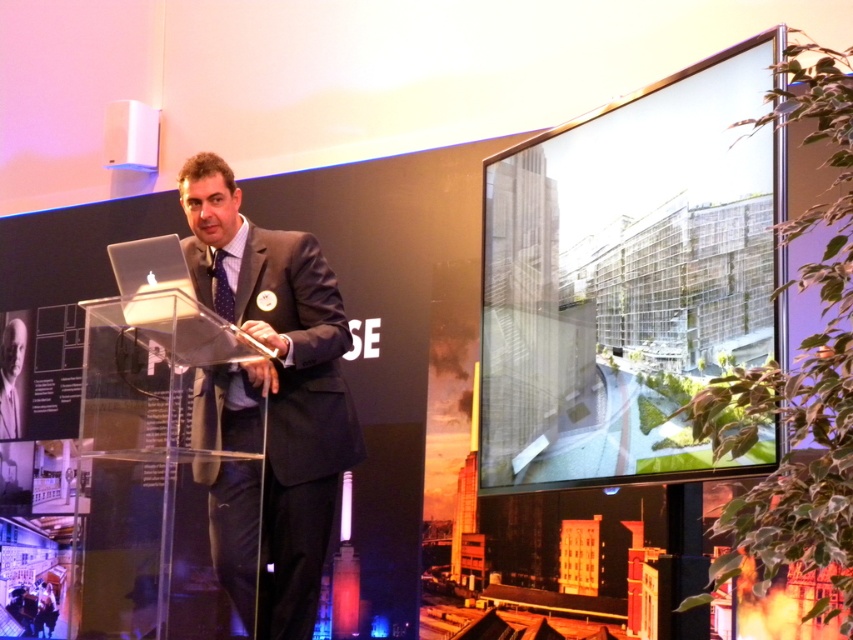
You are an attendee at the conference and want to take a photo of the presenter. Since the transparent glass screen at upper right is in the way, can you move to your left to capture the dark gray suit at center without the screen blocking the view?

The transparent glass screen at upper right is to the right of the dark gray suit at center, so moving to your left would position the screen behind you, allowing you to capture the dark gray suit at center without obstruction.

You are an event planner setting up a virtual conference room. The man in the dark gray suit at center is scheduled to present next. Where should you place his virtual avatar in the coordinate system of the room, given that the podium is at position 0.5 on the x and y axes?

The dark gray suit at center is positioned at point 0.633 on the x and 0.318 on the y coordinates. Since the podium is at 0.5 on both axes, the avatar should be placed slightly to the right and below the podium center to match the original positioning.

You are an attendee at the conference. You notice the transparent glass screen at upper right and the blue dotted fabric tie at center. Which object is higher in the image?

The transparent glass screen at upper right is taller than the blue dotted fabric tie at center.